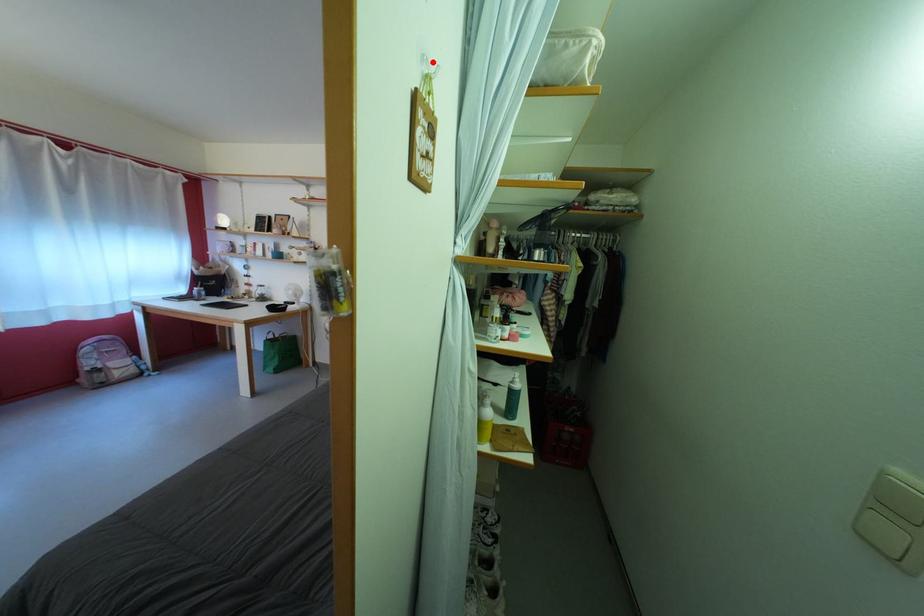
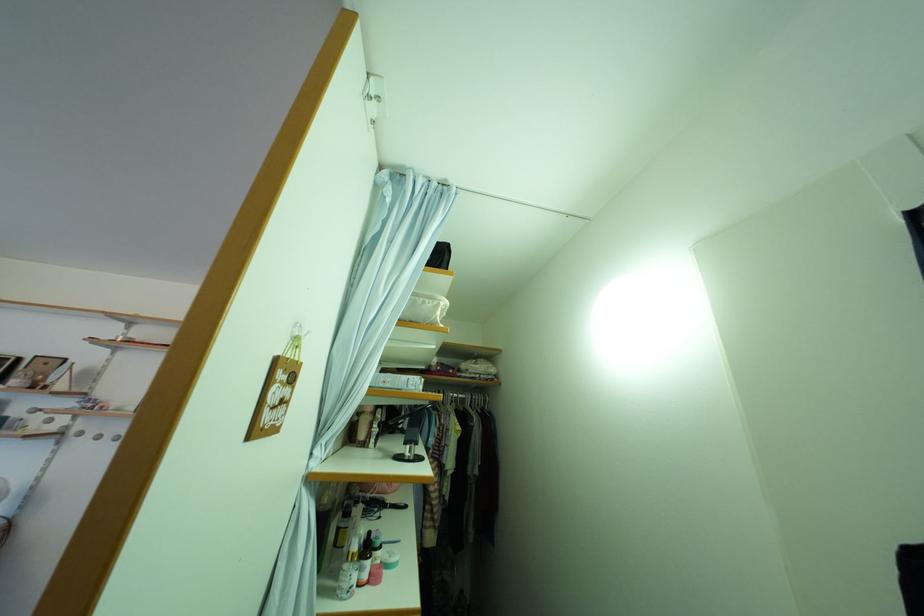
Where in the second image is the point corresponding to the highlighted location from the first image?

(305, 329)